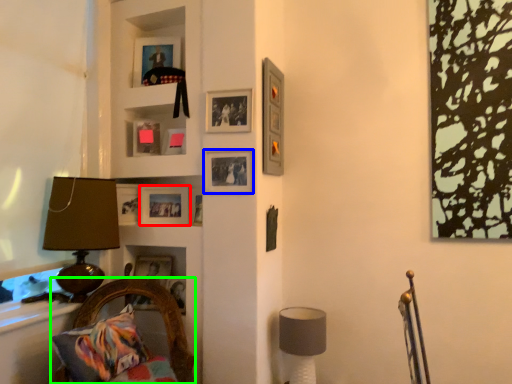
Question: Which object is positioned farthest from picture frame (highlighted by a red box)? Select from picture frame (highlighted by a blue box) and furniture (highlighted by a green box).

Choices:
 (A) picture frame
 (B) furniture

Answer: (B)